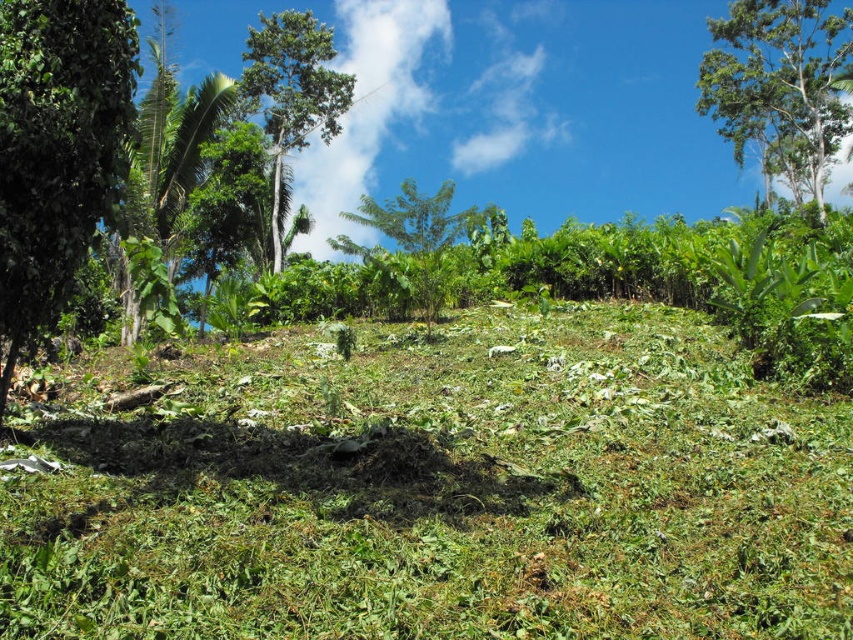
Which is more to the left, green leafy tree at upper left or green leafy tree at center?

Positioned to the left is green leafy tree at upper left.

Between green leafy tree at upper left and green leafy tree at center, which one is positioned lower?

green leafy tree at center is below.

What are the coordinates of `green leafy tree at upper left` in the screenshot? It's located at (291, 92).

What do you see at coordinates (432, 488) in the screenshot? The height and width of the screenshot is (640, 853). I see `green leafy grass at center` at bounding box center [432, 488].

Who is higher up, green leafy grass at center or green leafy tree at upper left?

green leafy tree at upper left is above.

Which is behind, point (279, 628) or point (265, 92)?

The point (265, 92) is more distant.

The image size is (853, 640). Find the location of `green leafy grass at center`. green leafy grass at center is located at coordinates (432, 488).

Who is positioned more to the left, green leafy grass at center or green leafy tree at left?

Positioned to the left is green leafy tree at left.

Can you confirm if green leafy grass at center is positioned above green leafy tree at left?

Incorrect, green leafy grass at center is not positioned above green leafy tree at left.

Is point (492, 435) less distant than point (115, 163)?

No.

The image size is (853, 640). In order to click on green leafy grass at center in this screenshot , I will do `click(432, 488)`.